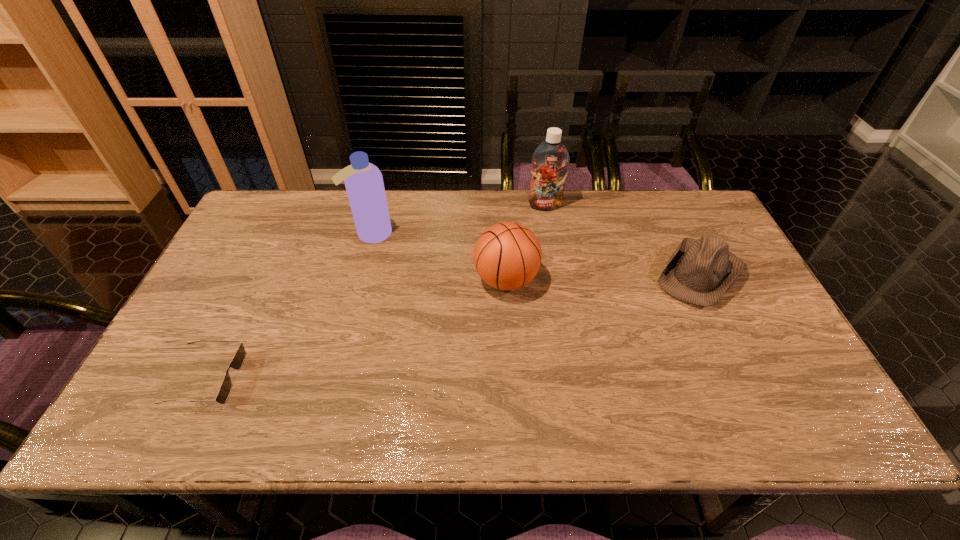
Image resolution: width=960 pixels, height=540 pixels. I want to click on free space located 0.230m on the front label of the farther shampoo, so click(554, 259).

Find the location of a particular element. vacant space located on the back of the third shortest object is located at coordinates 503,233.

Find the location of `vacant area located 0.170m on the back of the second shortest object`. vacant area located 0.170m on the back of the second shortest object is located at coordinates (668, 208).

I want to click on blank space located 0.240m on the front-facing side of the shortest object, so click(340, 379).

Locate an element on the screen. Image resolution: width=960 pixels, height=540 pixels. object at the near edge is located at coordinates (238, 360).

Image resolution: width=960 pixels, height=540 pixels. I want to click on object located at the left edge, so click(238, 360).

This screenshot has height=540, width=960. I want to click on object situated at the right edge, so click(x=700, y=272).

You are a GUI agent. You are given a task and a screenshot of the screen. Output one action in this format:
    pyautogui.click(x=<x>, y=<y>)
    Task: Click on the object that is at the near left corner
    
    Given the screenshot: What is the action you would take?
    pyautogui.click(x=238, y=360)

In the image, there is a desktop. Where is `vacant space at the far edge`? vacant space at the far edge is located at coordinates (464, 190).

The width and height of the screenshot is (960, 540). Identify the location of free region at the near edge. (429, 430).